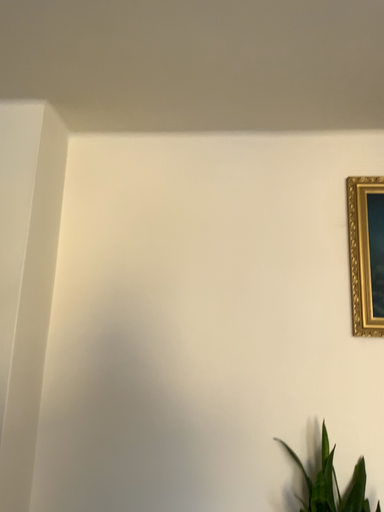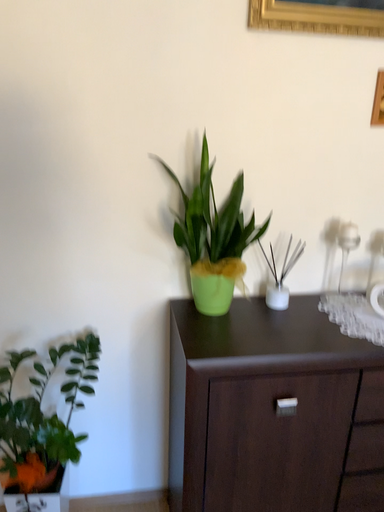
Question: How did the camera likely rotate when shooting the video?

Choices:
 (A) rotated right
 (B) rotated left

Answer: (A)